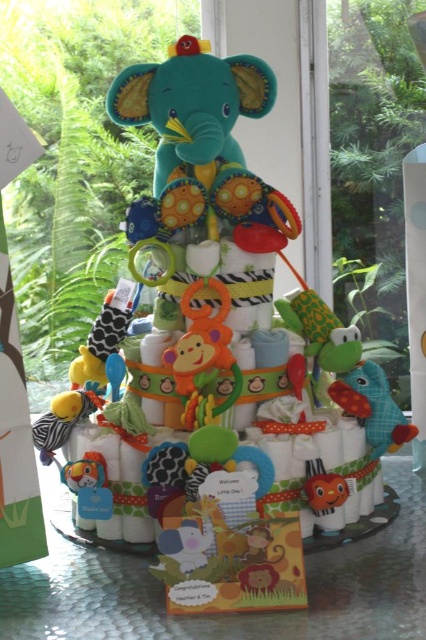
You are at a baby shower and see the diaper cake with a soft plush fish at center and a matte orange plush toy at center. Which one is wider?

The soft plush fish at center is wider than the matte orange plush toy at center.